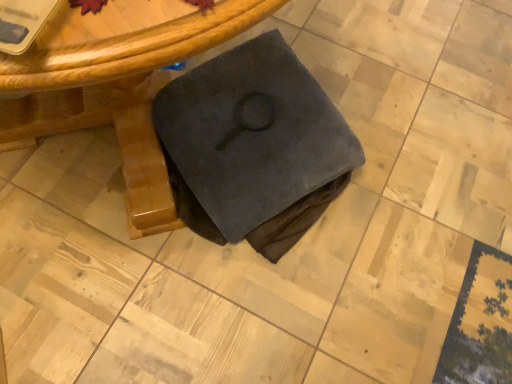
Identify the location of empty space that is in between wooden table at center and dark suede book at center. (315, 221).